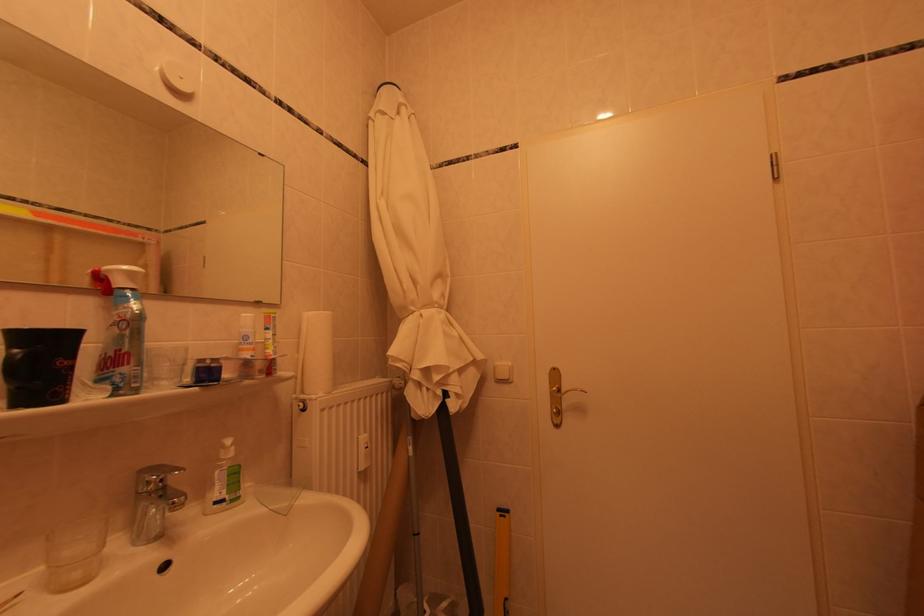
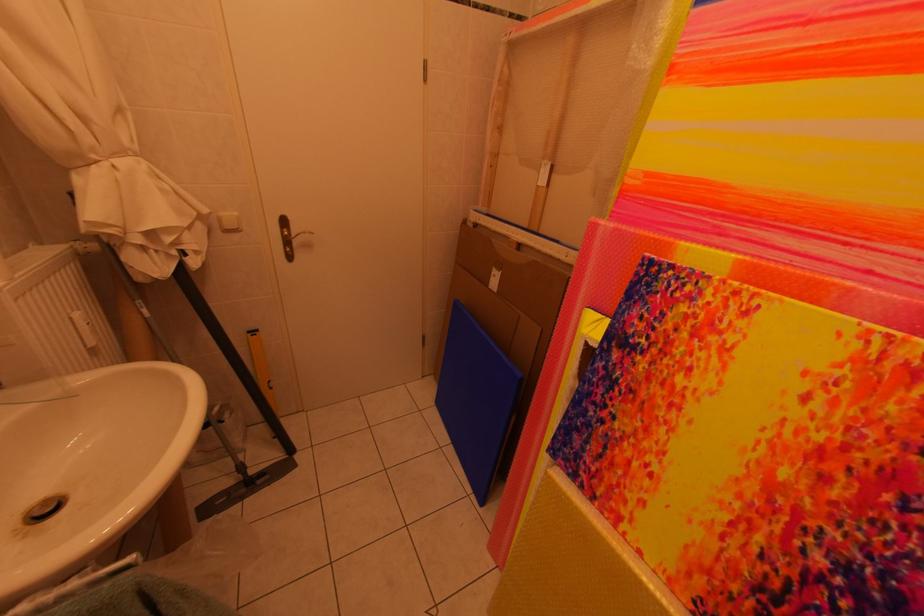
In the second image, find the point that corresponds to point 506,367 in the first image.

(229, 217)